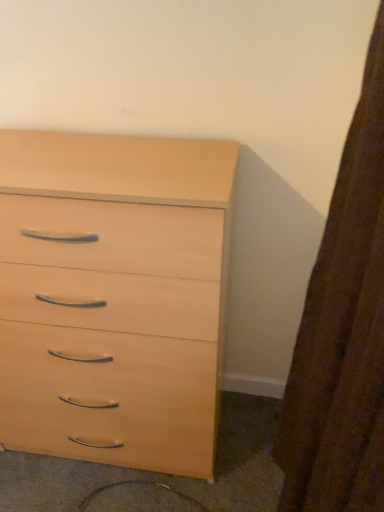
Question: Is light wood drawer at lower center to the left of light wood chest of drawers at center from the viewer's perspective?

Choices:
 (A) no
 (B) yes

Answer: (A)

Question: Does light wood drawer at lower center have a greater width compared to light wood chest of drawers at center?

Choices:
 (A) yes
 (B) no

Answer: (A)

Question: Considering the relative positions of light wood drawer at lower center and light wood chest of drawers at center in the image provided, is light wood drawer at lower center to the right of light wood chest of drawers at center from the viewer's perspective?

Choices:
 (A) yes
 (B) no

Answer: (A)

Question: Does light wood drawer at lower center have a lesser width compared to light wood chest of drawers at center?

Choices:
 (A) no
 (B) yes

Answer: (A)

Question: Is light wood drawer at lower center oriented towards light wood chest of drawers at center?

Choices:
 (A) yes
 (B) no

Answer: (B)

Question: Is brown textured curtain at right wider or thinner than light wood drawer at lower center?

Choices:
 (A) thin
 (B) wide

Answer: (A)

Question: From the image's perspective, is brown textured curtain at right located above or below light wood drawer at lower center?

Choices:
 (A) above
 (B) below

Answer: (A)

Question: From a real-world perspective, is brown textured curtain at right above or below light wood drawer at lower center?

Choices:
 (A) above
 (B) below

Answer: (A)

Question: Considering the positions of point pos(311,329) and point pos(201,508), is point pos(311,329) closer or farther from the camera than point pos(201,508)?

Choices:
 (A) farther
 (B) closer

Answer: (B)

Question: In terms of width, does brown textured curtain at right look wider or thinner when compared to light wood chest of drawers at center?

Choices:
 (A) thin
 (B) wide

Answer: (A)

Question: From the image's perspective, is brown textured curtain at right positioned above or below light wood chest of drawers at center?

Choices:
 (A) below
 (B) above

Answer: (A)

Question: Is brown textured curtain at right situated inside light wood chest of drawers at center or outside?

Choices:
 (A) inside
 (B) outside

Answer: (B)

Question: Is brown textured curtain at right to the left or to the right of light wood chest of drawers at center in the image?

Choices:
 (A) right
 (B) left

Answer: (A)

Question: From a real-world perspective, relative to brown textured curtain at right, is light wood chest of drawers at center vertically above or below?

Choices:
 (A) above
 (B) below

Answer: (B)

Question: From the image's perspective, is light wood chest of drawers at center above or below brown textured curtain at right?

Choices:
 (A) above
 (B) below

Answer: (A)